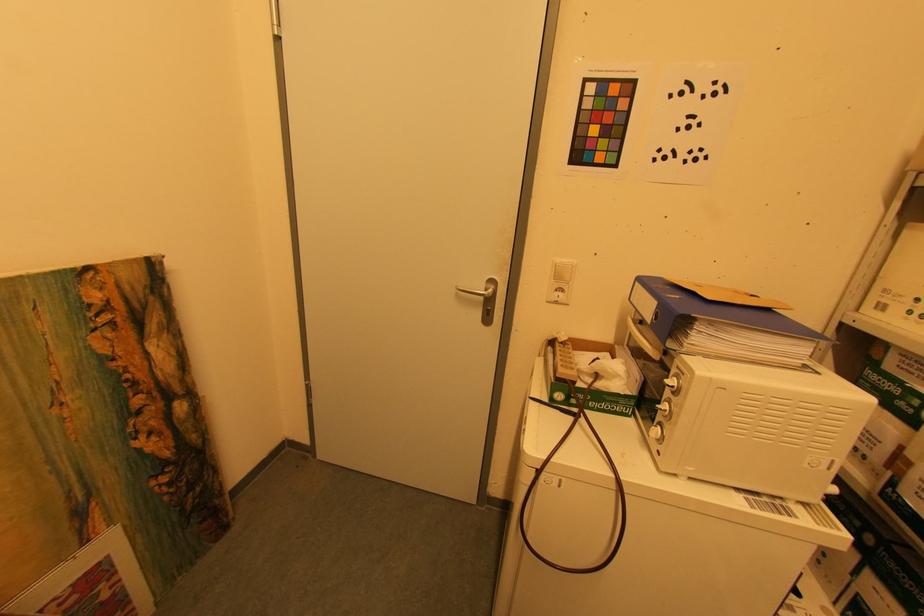
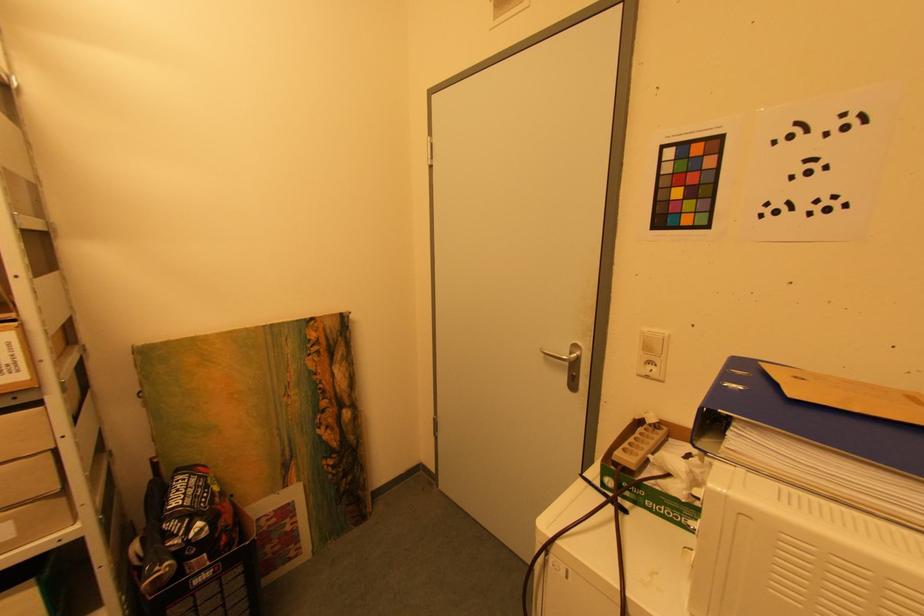
Question: Based on the continuous images, in which direction is the camera rotating? Reply with the corresponding letter.

Choices:
 (A) Left
 (B) Right
 (C) Up
 (D) Down

Answer: (A)